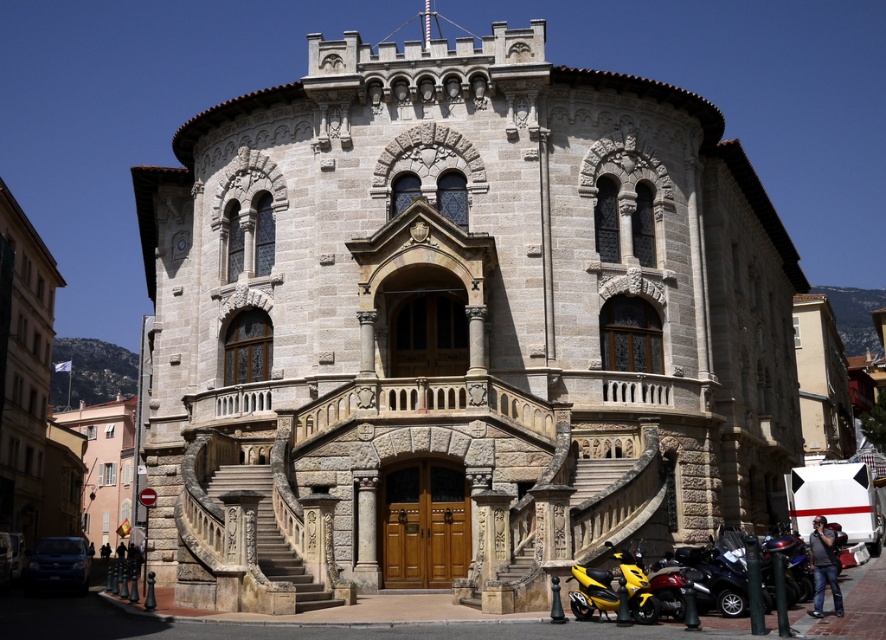
You are a delivery person with a package that needs to be delivered to the stone textured church at center. Your scooter, the yellow matte scooter at lower right, has a maximum range of 80 feet before needing a recharge. Can you reach the church without needing to recharge your scooter?

The distance between the stone textured church at center and the yellow matte scooter at lower right is 81.50 feet, which exceeds the scooter maximum range of 80 feet. Therefore, you cannot reach the church without recharging your scooter.

You are standing in front of the grand ornate building and see a point at coordinates point (456, 326). Based on the scene description, can you determine which part of the building this point is located on?

The point (456, 326) is located on the stone textured church at center.